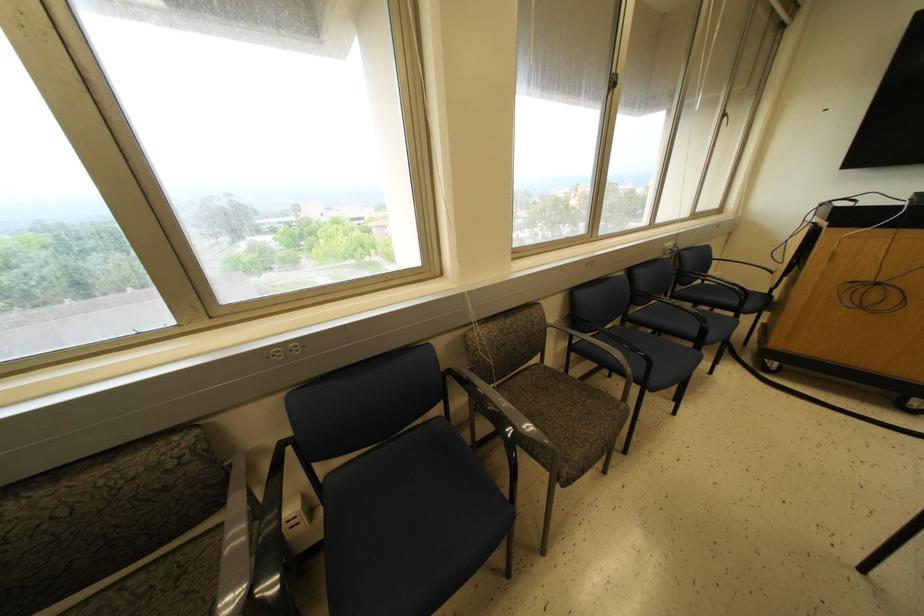
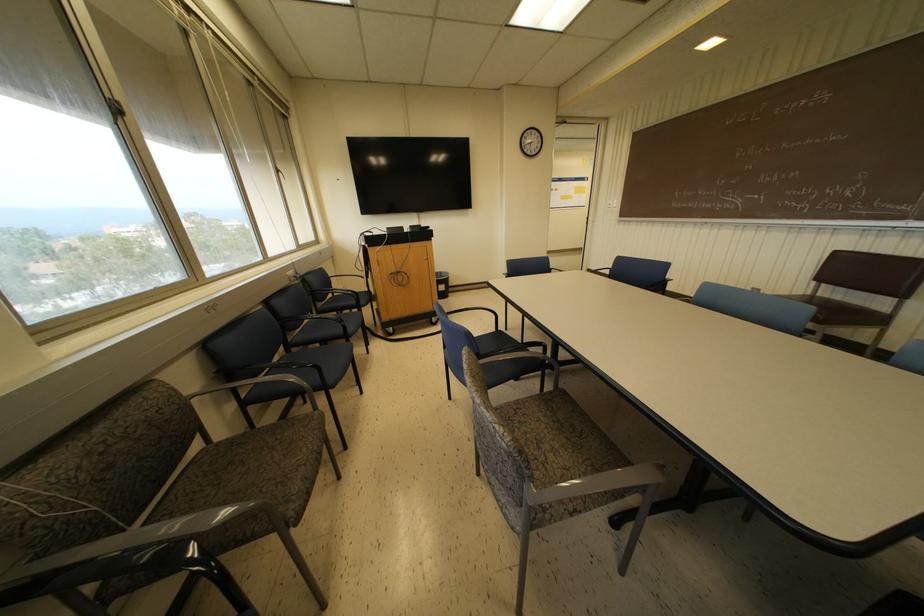
The point at (x=624, y=399) is marked in the first image. Where is the corresponding point in the second image?

(314, 408)